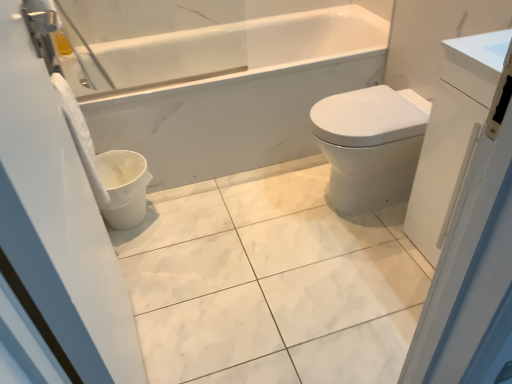
You are a GUI agent. You are given a task and a screenshot of the screen. Output one action in this format:
    pyautogui.click(x=<x>, y=<y>)
    Task: Click on the free space in front of white glossy bidet at right
    
    Given the screenshot: What is the action you would take?
    pyautogui.click(x=356, y=259)